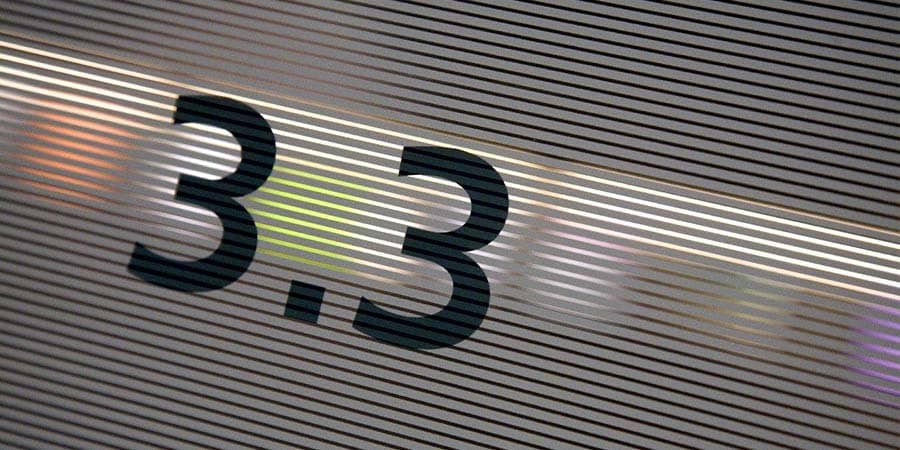
You are a GUI agent. You are given a task and a screenshot of the screen. Output one action in this format:
    pyautogui.click(x=<x>, y=<y>)
    Task: Click on the light
    
    Given the screenshot: What is the action you would take?
    pyautogui.click(x=646, y=206)